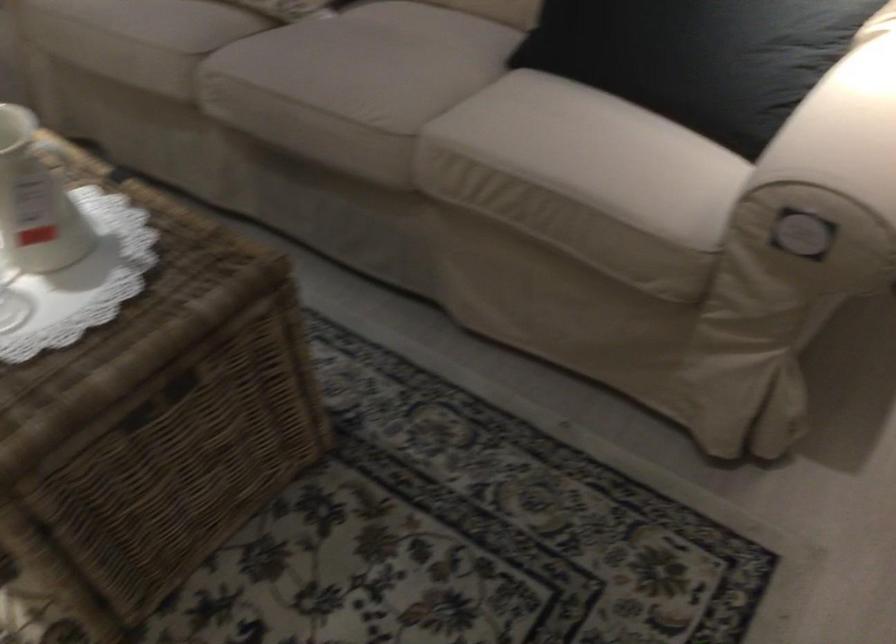
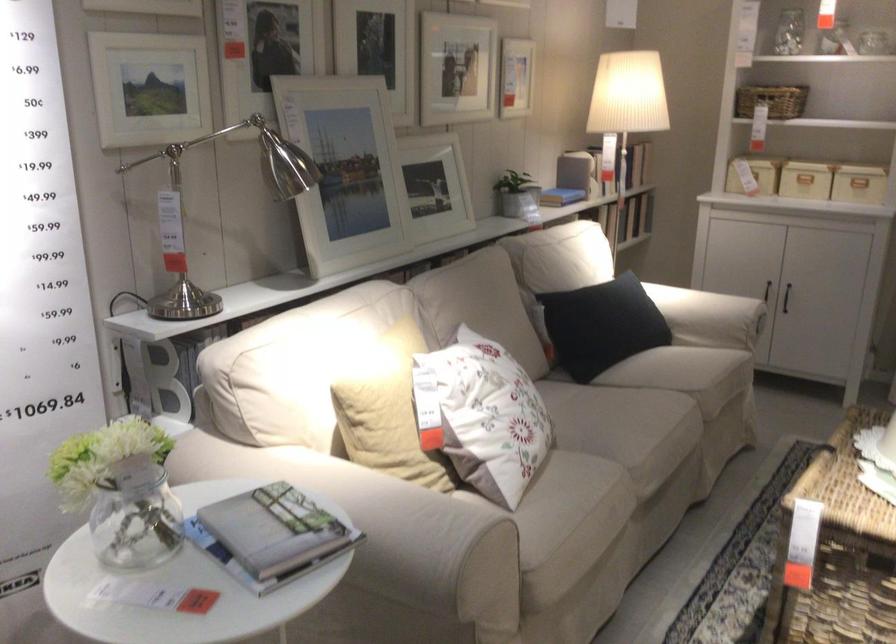
Locate, in the second image, the point that corresponds to the point at 727,134 in the first image.

(709, 317)